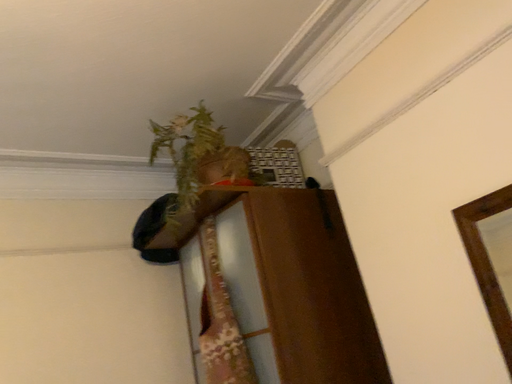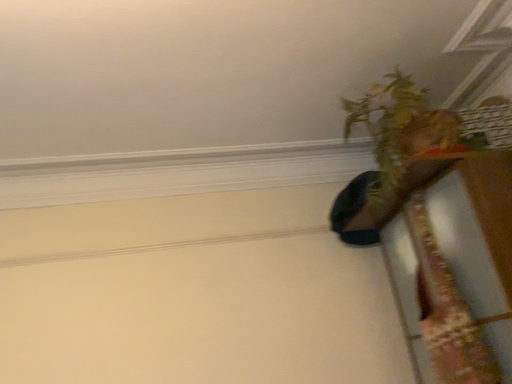
Question: How did the camera likely rotate when shooting the video?

Choices:
 (A) rotated left
 (B) rotated right

Answer: (A)